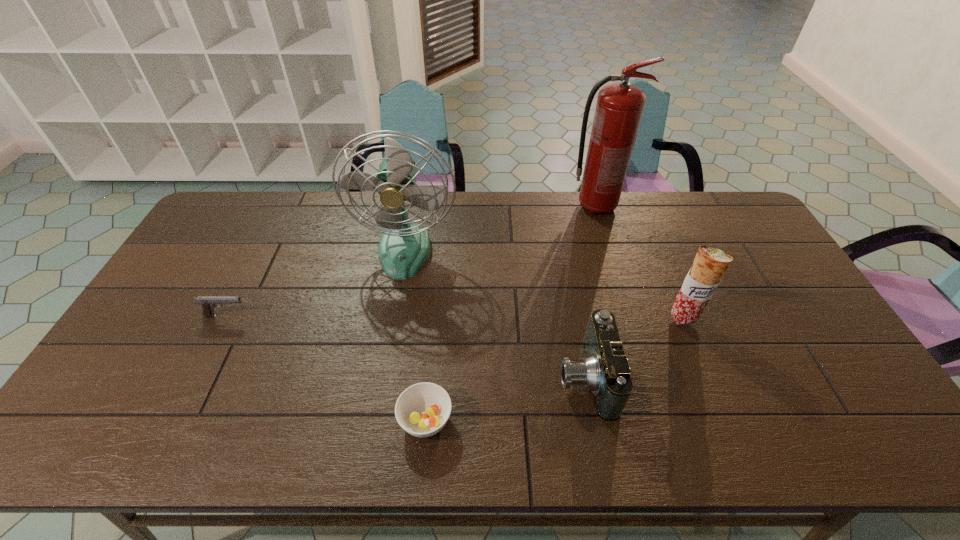
The width and height of the screenshot is (960, 540). I want to click on camcorder located at the near edge, so click(605, 371).

This screenshot has width=960, height=540. What are the coordinates of `soup bowl present at the near edge` in the screenshot? It's located at (422, 410).

Find the location of a particular element. object that is at the left edge is located at coordinates (208, 303).

The width and height of the screenshot is (960, 540). What are the coordinates of `free space at the far edge` in the screenshot? It's located at (622, 232).

This screenshot has width=960, height=540. Identify the location of blank space at the near edge. (179, 429).

Locate an element on the screen. vacant area at the right edge is located at coordinates (828, 410).

The width and height of the screenshot is (960, 540). In order to click on free space between the fourth shortest object and the fifth nearest object in this screenshot , I will do `click(544, 284)`.

Identify the location of vacant point located between the fifth nearest object and the second shortest object. The image size is (960, 540). pyautogui.click(x=316, y=282).

This screenshot has width=960, height=540. I want to click on free space between the third shortest object and the tallest object, so click(590, 292).

Find the location of a particular element. Image resolution: width=960 pixels, height=540 pixels. free space between the fourth shortest object and the fire extinguisher is located at coordinates (639, 262).